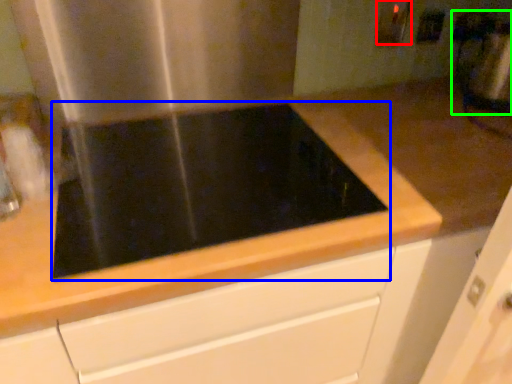
Question: Estimate the real-world distances between objects in this image. Which object is closer to electric outlet (highlighted by a red box), gas stove (highlighted by a blue box) or blender (highlighted by a green box)?

Choices:
 (A) gas stove
 (B) blender

Answer: (B)